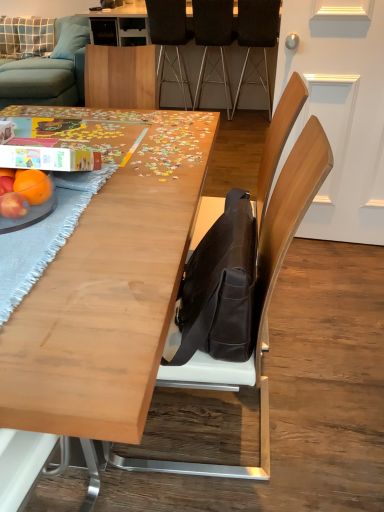
Question: From the image's perspective, does black leather chair at upper center, which is the 4th chair from front to back, appear lower than light wood table at center, arranged as the second table when viewed from the back?

Choices:
 (A) yes
 (B) no

Answer: (B)

Question: From a real-world perspective, is black leather chair at upper center, which is the 4th chair from front to back, positioned over light wood table at center, which appears as the 1th table when viewed from the front, based on gravity?

Choices:
 (A) no
 (B) yes

Answer: (B)

Question: From a real-world perspective, is black leather chair at upper center, which is the first chair in back-to-front order, below light wood table at center, placed as the second table when sorted from top to bottom?

Choices:
 (A) no
 (B) yes

Answer: (A)

Question: Does black leather chair at upper center, which is the 4th chair from front to back, appear on the right side of light wood table at center, which appears as the 1th table when viewed from the front?

Choices:
 (A) yes
 (B) no

Answer: (A)

Question: From the image's perspective, would you say black leather chair at upper center, which is the first chair in back-to-front order, is positioned over light wood table at center, placed as the second table when sorted from top to bottom?

Choices:
 (A) yes
 (B) no

Answer: (A)

Question: Considering the relative positions of black leather chair at upper center, which is the 4th chair from front to back, and light wood table at center, the first table when ordered from bottom to top, in the image provided, is black leather chair at upper center, which is the 4th chair from front to back, behind light wood table at center, the first table when ordered from bottom to top,?

Choices:
 (A) no
 (B) yes

Answer: (B)

Question: Is matte orange at table left bigger than brown leather chair at center, which is the 1th chair from front to back?

Choices:
 (A) no
 (B) yes

Answer: (A)

Question: Is matte orange at table left not inside brown leather chair at center, which is the 1th chair from front to back?

Choices:
 (A) no
 (B) yes

Answer: (B)

Question: From a real-world perspective, is matte orange at table left physically above brown leather chair at center, which is the 1th chair from front to back?

Choices:
 (A) no
 (B) yes

Answer: (B)

Question: Is matte orange at table left looking in the opposite direction of brown leather chair at center, which is the 1th chair from front to back?

Choices:
 (A) no
 (B) yes

Answer: (A)

Question: Is matte orange at table left not near brown leather chair at center, which is the 4th chair from back to front?

Choices:
 (A) yes
 (B) no

Answer: (B)

Question: Is matte orange at table left aimed at brown leather chair at center, which is the 1th chair from front to back?

Choices:
 (A) yes
 (B) no

Answer: (B)

Question: Is light blue fabric pillow at upper left, the first pillow when ordered from left to right, at the left side of matte orange at table left?

Choices:
 (A) yes
 (B) no

Answer: (A)